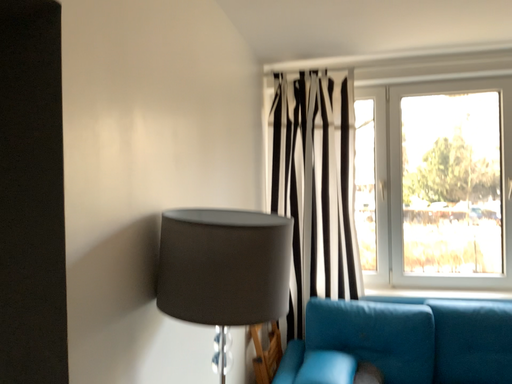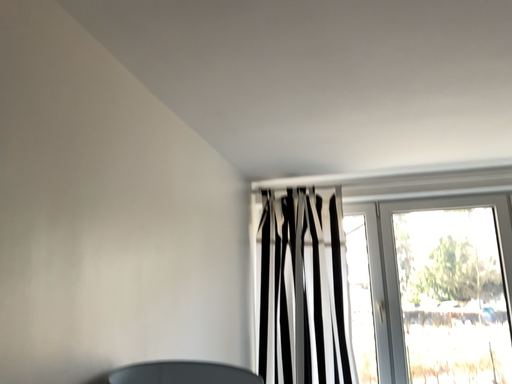
Question: How did the camera likely rotate when shooting the video?

Choices:
 (A) rotated upward
 (B) rotated downward

Answer: (A)